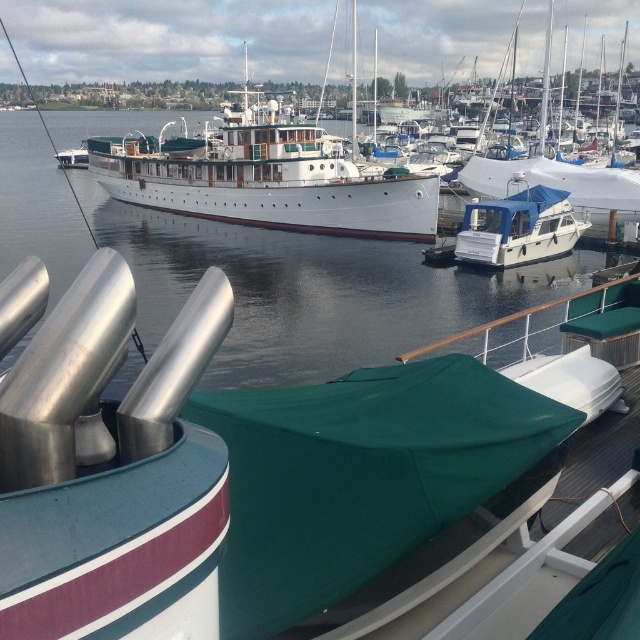
Does point (518, 458) lie in front of point (513, 163)?

Yes.

Does polished stainless steel exhaust pipes at center have a greater width compared to white matte sailboat at upper right?

In fact, polished stainless steel exhaust pipes at center might be narrower than white matte sailboat at upper right.

Consider the image. Measure the distance between point (108, 577) and camera.

The distance of point (108, 577) from camera is 2.79 meters.

Identify the location of polished stainless steel exhaust pipes at center. (234, 465).

Locate an element on the screen. polished stainless steel exhaust pipes at center is located at coordinates (234, 465).

Is polished stainless steel exhaust pipes at center above white glossy boat at center?

Incorrect, polished stainless steel exhaust pipes at center is not positioned above white glossy boat at center.

Does point (118, 348) come behind point (486, 211)?

No, it is not.

What are the coordinates of `polished stainless steel exhaust pipes at center` in the screenshot? It's located at (234, 465).

Is glossy water at center thinner than white matte sailboat at upper right?

In fact, glossy water at center might be wider than white matte sailboat at upper right.

Between glossy water at center and white matte sailboat at upper right, which one appears on the left side from the viewer's perspective?

glossy water at center is more to the left.

Is point (285, 346) positioned after point (630, 214)?

That is False.

I want to click on glossy water at center, so click(x=308, y=291).